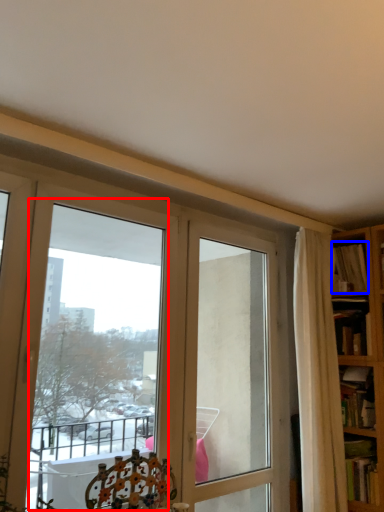
Question: Among these objects, which one is farthest to the camera, bay window (highlighted by a red box) or book (highlighted by a blue box)?

Choices:
 (A) bay window
 (B) book

Answer: (B)